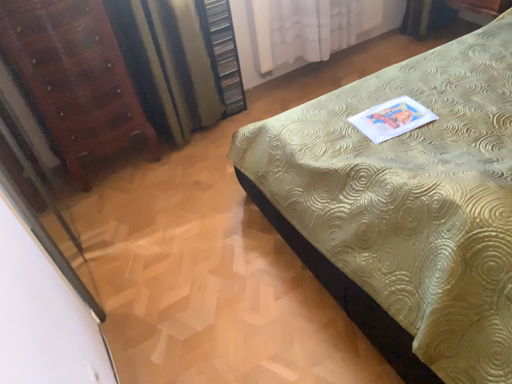
Question: Should I look upward or downward to see gold textured bed at center?

Choices:
 (A) up
 (B) down

Answer: (A)

Question: From the image's perspective, is striped fabric curtain at left, marked as the first curtain in a left-to-right arrangement, located beneath wooden dresser at upper center?

Choices:
 (A) yes
 (B) no

Answer: (A)

Question: Does striped fabric curtain at left, positioned as the 2th curtain in right-to-left order, have a greater width compared to wooden dresser at upper center?

Choices:
 (A) yes
 (B) no

Answer: (A)

Question: Does striped fabric curtain at left, positioned as the 2th curtain in right-to-left order, turn towards wooden dresser at upper center?

Choices:
 (A) no
 (B) yes

Answer: (A)

Question: Is striped fabric curtain at left, positioned as the 2th curtain in right-to-left order, further to the viewer compared to wooden dresser at upper center?

Choices:
 (A) no
 (B) yes

Answer: (A)

Question: Can you confirm if striped fabric curtain at left, positioned as the 2th curtain in right-to-left order, is thinner than wooden dresser at upper center?

Choices:
 (A) no
 (B) yes

Answer: (A)

Question: Considering the relative positions of striped fabric curtain at left, marked as the first curtain in a left-to-right arrangement, and wooden dresser at upper center in the image provided, is striped fabric curtain at left, marked as the first curtain in a left-to-right arrangement, to the left of wooden dresser at upper center from the viewer's perspective?

Choices:
 (A) no
 (B) yes

Answer: (B)

Question: Is striped fabric curtain at left, marked as the first curtain in a left-to-right arrangement, surrounded by transparent glass screen door at left?

Choices:
 (A) yes
 (B) no

Answer: (B)

Question: From a real-world perspective, is transparent glass screen door at left on striped fabric curtain at left, positioned as the 2th curtain in right-to-left order?

Choices:
 (A) yes
 (B) no

Answer: (B)

Question: From the image's perspective, is transparent glass screen door at left located above striped fabric curtain at left, marked as the first curtain in a left-to-right arrangement?

Choices:
 (A) yes
 (B) no

Answer: (B)

Question: Is the depth of transparent glass screen door at left greater than that of striped fabric curtain at left, positioned as the 2th curtain in right-to-left order?

Choices:
 (A) no
 (B) yes

Answer: (A)

Question: Does transparent glass screen door at left turn towards striped fabric curtain at left, marked as the first curtain in a left-to-right arrangement?

Choices:
 (A) no
 (B) yes

Answer: (B)

Question: Is transparent glass screen door at left to the right of striped fabric curtain at left, positioned as the 2th curtain in right-to-left order, from the viewer's perspective?

Choices:
 (A) yes
 (B) no

Answer: (B)

Question: Considering the relative sizes of mahogany wood dresser at left and striped fabric curtain at left, positioned as the 2th curtain in right-to-left order, in the image provided, is mahogany wood dresser at left taller than striped fabric curtain at left, positioned as the 2th curtain in right-to-left order,?

Choices:
 (A) yes
 (B) no

Answer: (A)